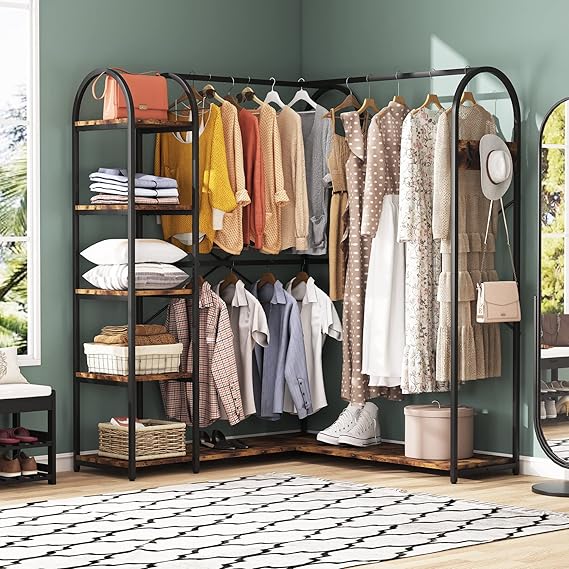
At what (x,y) coordinates should I click in order to perform the action: click on back view of shoes on shelf. Please return your answer as a coordinate pair (x, y). This screenshot has height=569, width=569. Looking at the image, I should click on (8, 473), (30, 470), (8, 441), (28, 436).